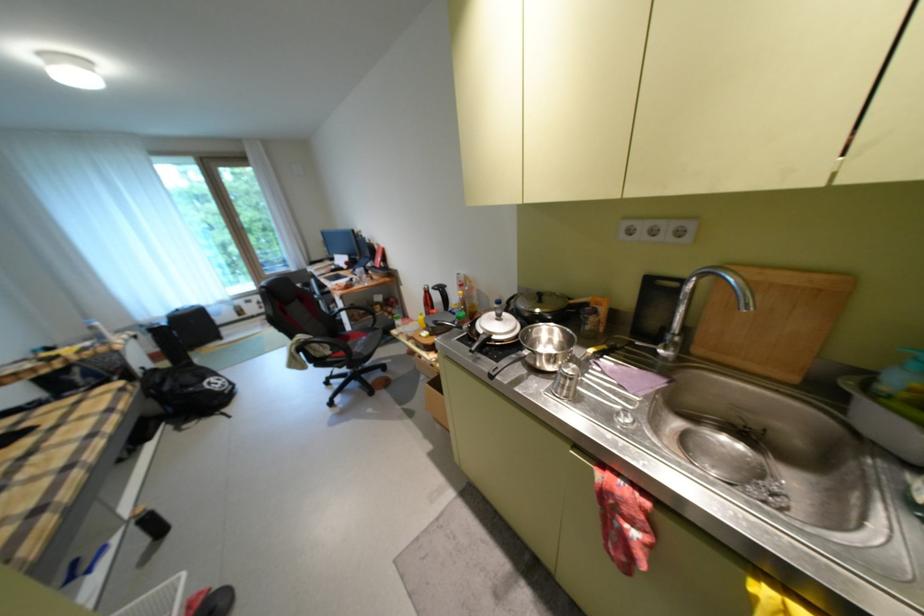
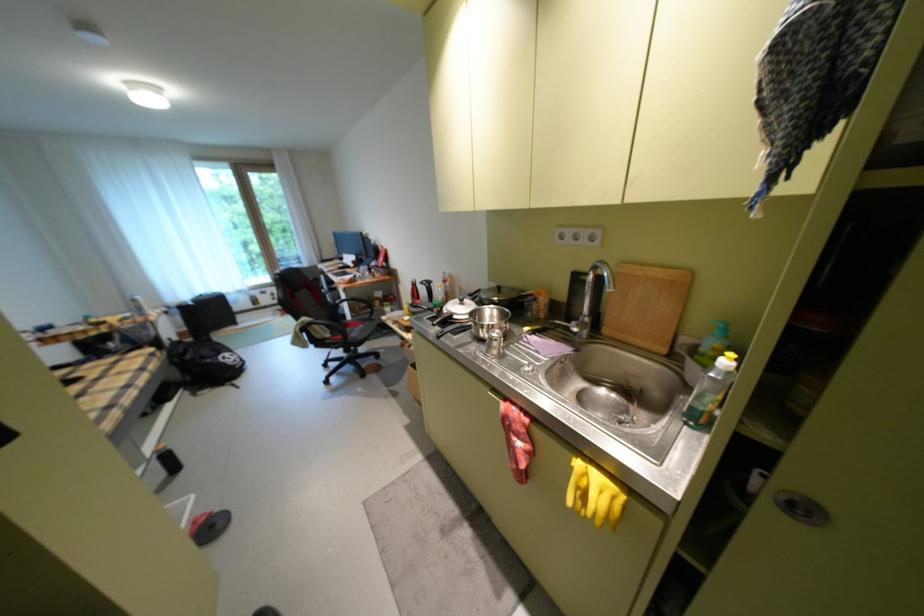
The point at (x=548, y=300) is marked in the first image. Where is the corresponding point in the second image?

(507, 292)